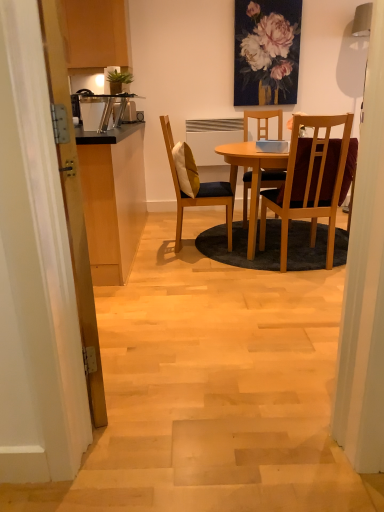
Question: Is matte floral painting at upper center smaller than wooden chair with cushion at center, positioned as the 2th chair in right-to-left order?

Choices:
 (A) no
 (B) yes

Answer: (B)

Question: Is wooden chair with cushion at center, acting as the first chair starting from the left, inside matte floral painting at upper center?

Choices:
 (A) yes
 (B) no

Answer: (B)

Question: Can you confirm if matte floral painting at upper center is positioned to the left of wooden chair with cushion at center, positioned as the 2th chair in right-to-left order?

Choices:
 (A) yes
 (B) no

Answer: (B)

Question: From a real-world perspective, is matte floral painting at upper center physically below wooden chair with cushion at center, acting as the first chair starting from the left?

Choices:
 (A) no
 (B) yes

Answer: (A)

Question: Could you tell me if matte floral painting at upper center is facing wooden chair with cushion at center, acting as the first chair starting from the left?

Choices:
 (A) no
 (B) yes

Answer: (A)

Question: Is matte floral painting at upper center placed right next to wooden chair with cushion at center, acting as the first chair starting from the left?

Choices:
 (A) no
 (B) yes

Answer: (A)

Question: Does wooden table at center have a lesser height compared to wooden chair with cushion at center, acting as the first chair starting from the left?

Choices:
 (A) no
 (B) yes

Answer: (B)

Question: Considering the relative sizes of wooden table at center and wooden chair with cushion at center, acting as the first chair starting from the left, in the image provided, is wooden table at center thinner than wooden chair with cushion at center, acting as the first chair starting from the left,?

Choices:
 (A) no
 (B) yes

Answer: (A)

Question: Is wooden table at center to the right of wooden chair with cushion at center, positioned as the 2th chair in right-to-left order, from the viewer's perspective?

Choices:
 (A) yes
 (B) no

Answer: (A)

Question: From the image's perspective, is wooden table at center above wooden chair with cushion at center, positioned as the 2th chair in right-to-left order?

Choices:
 (A) yes
 (B) no

Answer: (B)

Question: Considering the relative positions of wooden table at center and wooden chair with cushion at center, positioned as the 2th chair in right-to-left order, in the image provided, is wooden table at center to the left of wooden chair with cushion at center, positioned as the 2th chair in right-to-left order, from the viewer's perspective?

Choices:
 (A) yes
 (B) no

Answer: (B)

Question: From a real-world perspective, is wooden table at center positioned over wooden chair with cushion at center, positioned as the 2th chair in right-to-left order, based on gravity?

Choices:
 (A) no
 (B) yes

Answer: (A)

Question: Would you say wooden table at center is outside yellow fabric pillow at center?

Choices:
 (A) yes
 (B) no

Answer: (A)